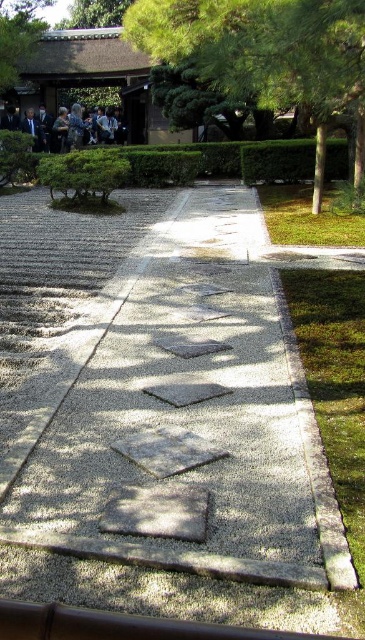
Question: Can you confirm if green leafy tree at upper right is wider than dark gray suit at upper left?

Choices:
 (A) no
 (B) yes

Answer: (A)

Question: Can you confirm if green leafy tree at upper right is positioned to the left of dark gray suit at upper left?

Choices:
 (A) yes
 (B) no

Answer: (B)

Question: Which point appears closest to the camera in this image?

Choices:
 (A) (316, 4)
 (B) (29, 122)

Answer: (A)

Question: Among these points, which one is nearest to the camera?

Choices:
 (A) (83, 134)
 (B) (228, 70)

Answer: (B)

Question: Does green leafy tree at upper right lie behind dark gray suit at upper left?

Choices:
 (A) no
 (B) yes

Answer: (A)